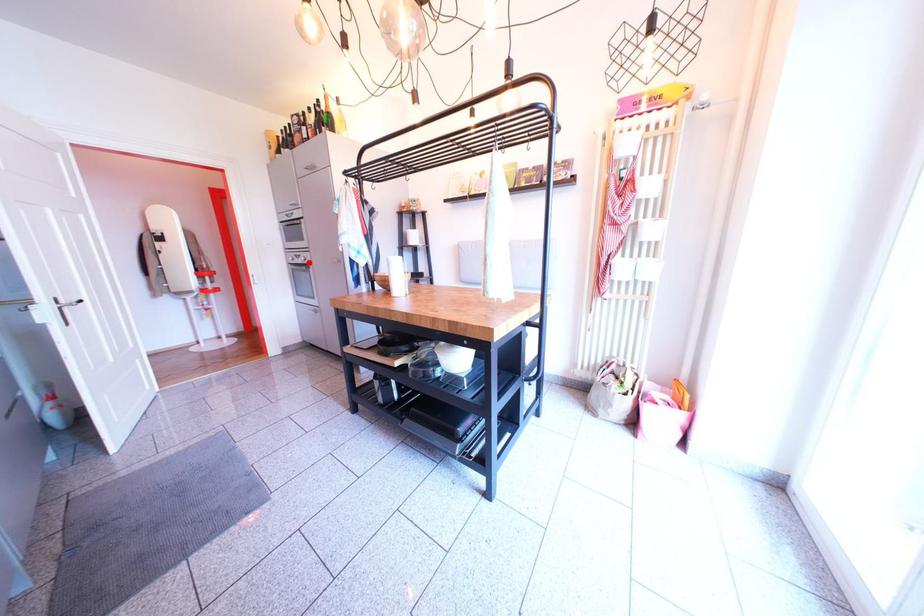
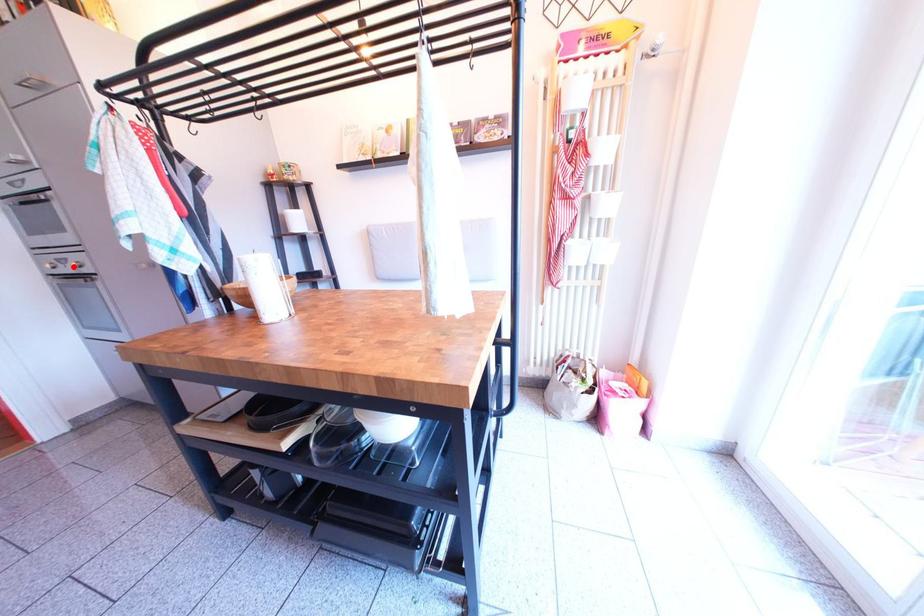
I am providing you with two images of the same scene from different viewpoints. A red point is marked on the first image and another point is marked on the second image. Does the point marked in image1 correspond to the same location as the one in image2?

Yes